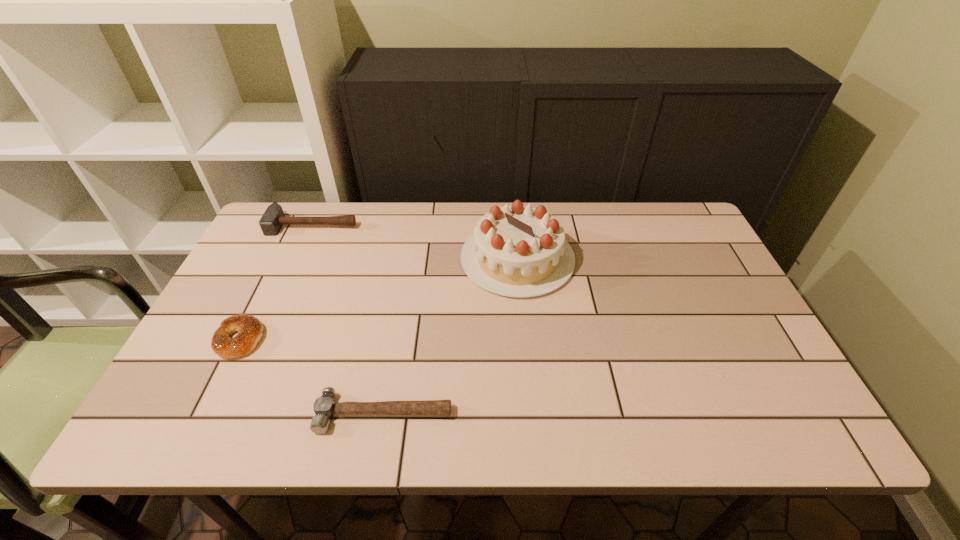
Image resolution: width=960 pixels, height=540 pixels. In the image, there is a desktop. Find the location of `vacant space at the near left corner`. vacant space at the near left corner is located at coordinates (169, 417).

I want to click on vacant space at the far right corner, so click(x=656, y=219).

At what (x,y) coordinates should I click in order to perform the action: click on free space between the bagel and the shorter hammer. Please return your answer as a coordinate pair (x, y). Looking at the image, I should click on (312, 376).

You are a GUI agent. You are given a task and a screenshot of the screen. Output one action in this format:
    pyautogui.click(x=<x>, y=<y>)
    Task: Click on the vacant region between the farther hammer and the rightmost object
    
    Given the screenshot: What is the action you would take?
    pyautogui.click(x=415, y=242)

This screenshot has width=960, height=540. In order to click on vacant point located between the bagel and the right hammer in this screenshot , I will do `click(312, 376)`.

The height and width of the screenshot is (540, 960). Find the location of `free spot between the rightmost object and the nearer hammer`. free spot between the rightmost object and the nearer hammer is located at coordinates (451, 336).

You are a GUI agent. You are given a task and a screenshot of the screen. Output one action in this format:
    pyautogui.click(x=<x>, y=<y>)
    Task: Click on the free space between the bagel and the birthday cake
    This screenshot has width=960, height=540.
    Given the screenshot: What is the action you would take?
    pyautogui.click(x=379, y=299)

You are a GUI agent. You are given a task and a screenshot of the screen. Output one action in this format:
    pyautogui.click(x=<x>, y=<y>)
    Task: Click on the free spot between the shorter hammer and the rightmost object
    Image resolution: width=960 pixels, height=540 pixels.
    Given the screenshot: What is the action you would take?
    pyautogui.click(x=451, y=336)

I want to click on free space between the taller hammer and the birthday cake, so click(415, 242).

I want to click on empty space that is in between the rightmost object and the left hammer, so pyautogui.click(x=415, y=242).